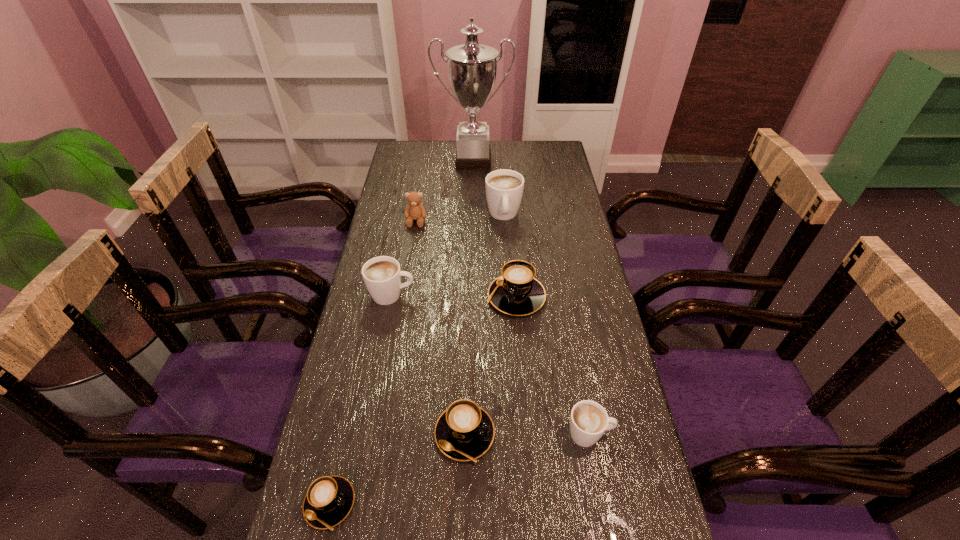
Locate an element on the screen. the tallest object is located at coordinates (472, 67).

At what (x,y) coordinates should I click in order to perform the action: click on trophy cup. Please return your answer as a coordinate pair (x, y). The height and width of the screenshot is (540, 960). Looking at the image, I should click on (472, 67).

You are a GUI agent. You are given a task and a screenshot of the screen. Output one action in this format:
    pyautogui.click(x=<x>, y=<y>)
    Task: Click on the farthest cappuccino
    The image size is (960, 540).
    Given the screenshot: What is the action you would take?
    pyautogui.click(x=504, y=188)

The height and width of the screenshot is (540, 960). In order to click on the tallest cappuccino in this screenshot , I will do `click(504, 188)`.

The width and height of the screenshot is (960, 540). Identify the location of brown teddy bear. (415, 210).

Locate an element on the screen. the leftmost white cappuccino is located at coordinates (382, 275).

Locate an element on the screen. The width and height of the screenshot is (960, 540). the second nearest white cappuccino is located at coordinates (382, 275).

The width and height of the screenshot is (960, 540). In order to click on the biggest black cappuccino in this screenshot , I will do `click(517, 292)`.

I want to click on the second farthest black cappuccino, so click(x=463, y=432).

This screenshot has width=960, height=540. In order to click on the rightmost cappuccino in this screenshot , I will do `click(589, 420)`.